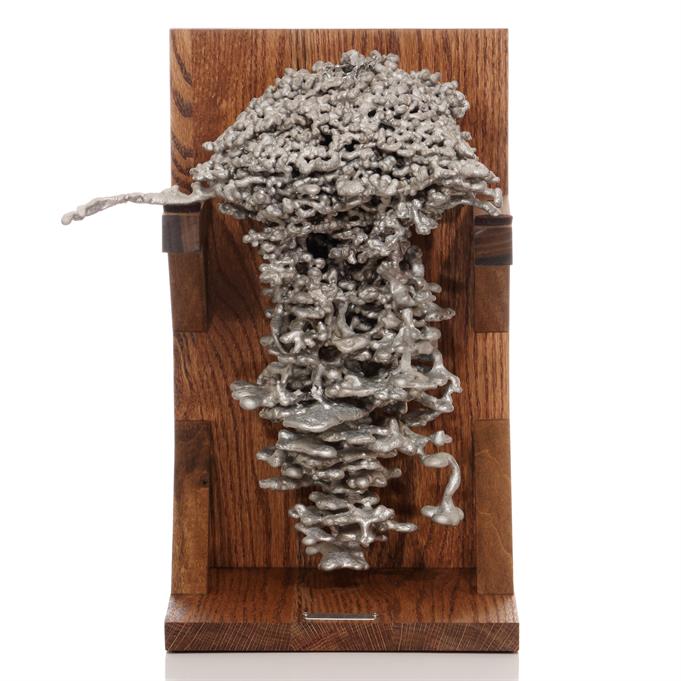
Identify the location of flat brown wooden board. (424, 620).